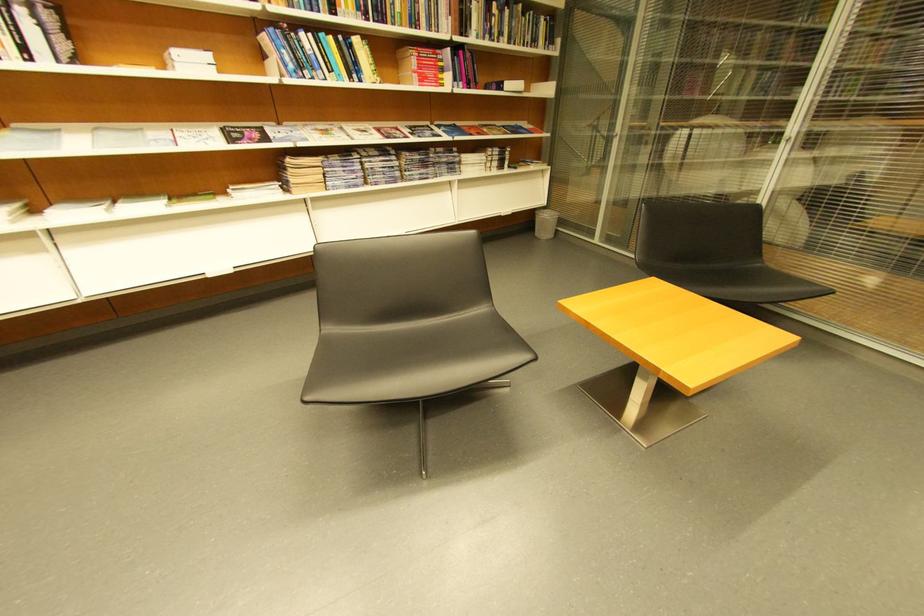
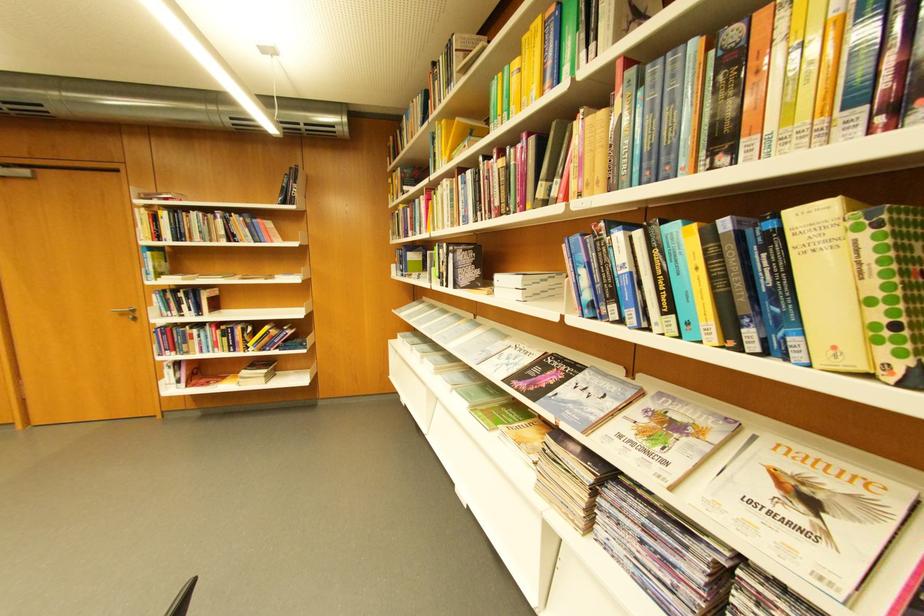
The point at (365, 129) is marked in the first image. Where is the corresponding point in the second image?

(800, 469)